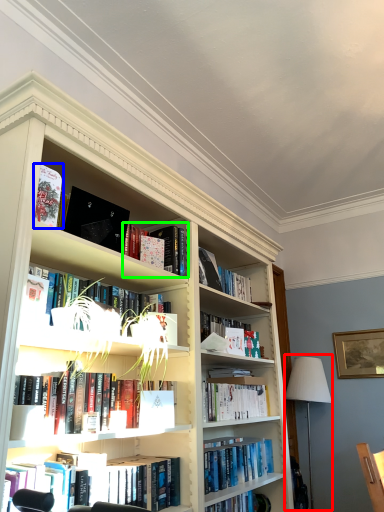
Question: Based on their relative distances, which object is nearer to table lamp (highlighted by a red box)? Choose from book (highlighted by a blue box) and book (highlighted by a green box).

Choices:
 (A) book
 (B) book

Answer: (B)